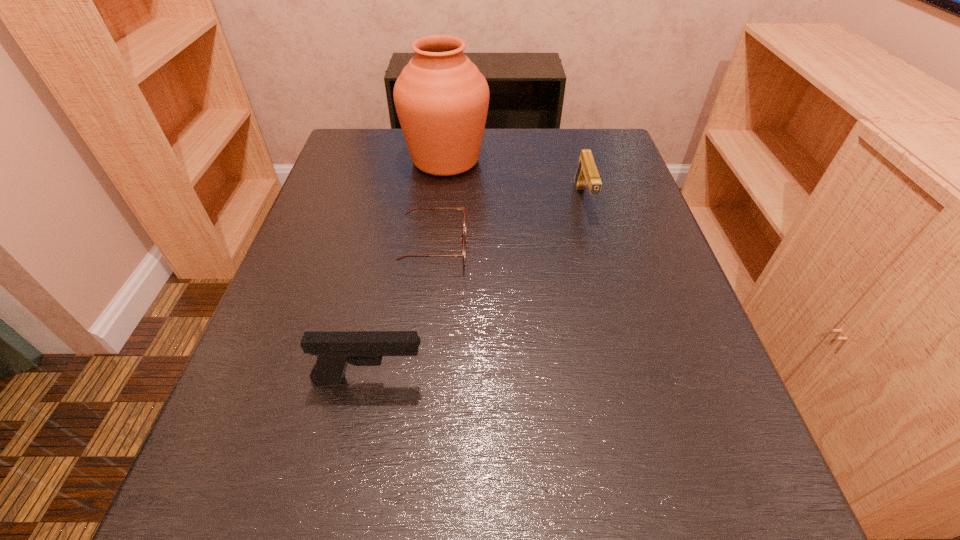
Where is `unoccupied position between the shortest object and the tallest object`? This screenshot has width=960, height=540. unoccupied position between the shortest object and the tallest object is located at coordinates (440, 204).

The image size is (960, 540). I want to click on free area in between the urn and the rightmost object, so click(x=515, y=180).

Locate an element on the screen. The image size is (960, 540). free space between the rightmost object and the nearer pistol is located at coordinates (476, 290).

Locate an element on the screen. vacant space in between the shortest object and the farther pistol is located at coordinates point(509,224).

This screenshot has width=960, height=540. I want to click on free area in between the left pistol and the farther pistol, so click(x=476, y=290).

The height and width of the screenshot is (540, 960). What are the coordinates of `blank region between the rightmost object and the urn` in the screenshot? It's located at (515, 180).

Locate an element on the screen. free space between the third farthest object and the farther pistol is located at coordinates (509, 224).

The width and height of the screenshot is (960, 540). What are the coordinates of `vacant point located between the shortest object and the urn` in the screenshot? It's located at (440, 204).

Locate an element on the screen. vacant space that is in between the left pistol and the spectacles is located at coordinates (401, 314).

Locate which object is the closest to the right pistol. Please provide its 2D coordinates. Your answer should be formatted as a tuple, i.e. [(x, y)], where the tuple contains the x and y coordinates of a point satisfying the conditions above.

[(441, 98)]